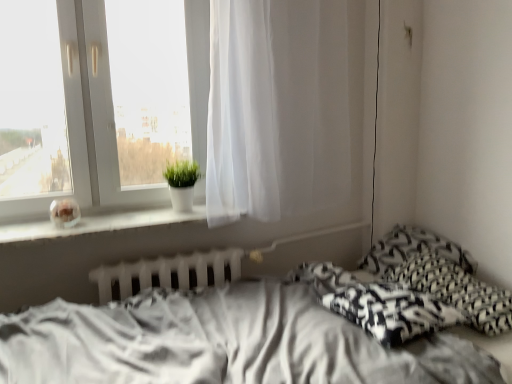
Question: Is white glossy vase at upper left positioned far away from black printed pillow at right, which is the second pillow in front-to-back order?

Choices:
 (A) yes
 (B) no

Answer: (A)

Question: Is white glossy vase at upper left positioned in front of black printed pillow at right, the first pillow in the back-to-front sequence?

Choices:
 (A) no
 (B) yes

Answer: (B)

Question: Does white glossy vase at upper left appear on the right side of black printed pillow at right, the first pillow in the back-to-front sequence?

Choices:
 (A) yes
 (B) no

Answer: (B)

Question: From the image's perspective, is white glossy vase at upper left over black printed pillow at right, which is the second pillow in front-to-back order?

Choices:
 (A) no
 (B) yes

Answer: (B)

Question: Can black printed pillow at right, which is the second pillow in front-to-back order, be found inside white glossy vase at upper left?

Choices:
 (A) yes
 (B) no

Answer: (B)

Question: From a real-world perspective, is black and white woven blanket at lower right positioned above or below black printed pillow at right, which is the second pillow in front-to-back order?

Choices:
 (A) below
 (B) above

Answer: (A)

Question: Is black and white woven blanket at lower right in front of or behind black printed pillow at right, the first pillow in the back-to-front sequence, in the image?

Choices:
 (A) behind
 (B) front

Answer: (B)

Question: From their relative heights in the image, would you say black and white woven blanket at lower right is taller or shorter than black printed pillow at right, the first pillow in the back-to-front sequence?

Choices:
 (A) tall
 (B) short

Answer: (B)

Question: From the image's perspective, is black and white woven blanket at lower right positioned above or below black printed pillow at right, the first pillow in the back-to-front sequence?

Choices:
 (A) below
 (B) above

Answer: (A)

Question: Is point (320, 195) positioned closer to the camera than point (104, 215)?

Choices:
 (A) farther
 (B) closer

Answer: (A)

Question: In terms of size, does white sheer curtain at center appear bigger or smaller than white matte window sill at left?

Choices:
 (A) big
 (B) small

Answer: (A)

Question: From the image's perspective, is white sheer curtain at center located above or below white matte window sill at left?

Choices:
 (A) above
 (B) below

Answer: (A)

Question: Which is correct: white sheer curtain at center is inside white matte window sill at left, or outside of it?

Choices:
 (A) outside
 (B) inside

Answer: (A)

Question: Is point (10, 228) positioned closer to the camera than point (189, 178)?

Choices:
 (A) farther
 (B) closer

Answer: (B)

Question: From a real-world perspective, is white matte window sill at left physically located above or below green matte plant at window?

Choices:
 (A) below
 (B) above

Answer: (A)